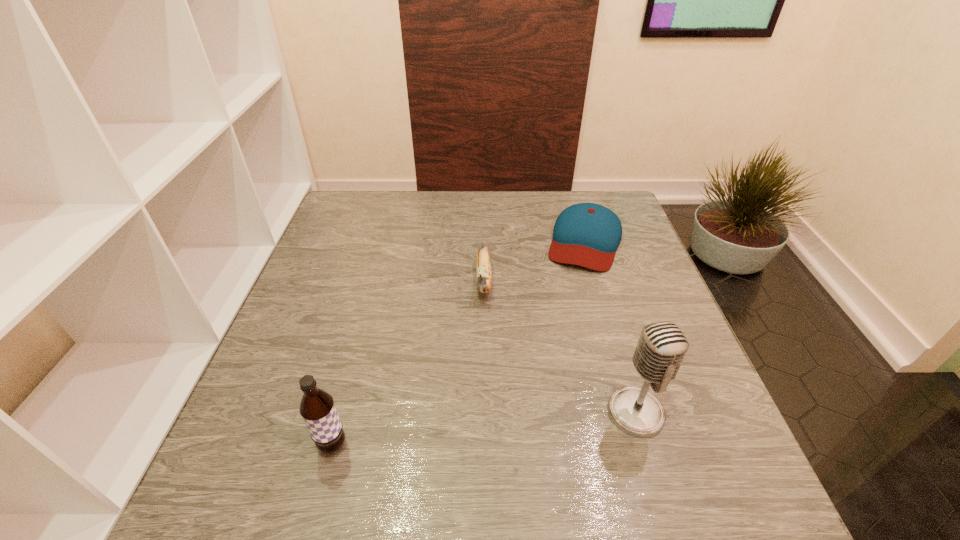
Image resolution: width=960 pixels, height=540 pixels. I want to click on object situated at the near left corner, so click(317, 408).

The height and width of the screenshot is (540, 960). What are the coordinates of `object at the far right corner` in the screenshot? It's located at (585, 234).

Find the location of a particular element. This screenshot has height=540, width=960. object located at the near right corner is located at coordinates (662, 346).

Locate an element on the screen. vacant area at the far edge of the desktop is located at coordinates (550, 206).

In the image, there is a desktop. At what (x,y) coordinates should I click in order to perform the action: click on free space at the near edge. Please return your answer as a coordinate pair (x, y). The image size is (960, 540). Looking at the image, I should click on (602, 437).

Find the location of `vacant space at the left edge`. vacant space at the left edge is located at coordinates (312, 314).

In the image, there is a desktop. Where is `free region at the right edge`? This screenshot has height=540, width=960. free region at the right edge is located at coordinates (638, 373).

The image size is (960, 540). Identify the location of vacant space at the near right corner of the desktop. (736, 446).

You are a GUI agent. You are given a task and a screenshot of the screen. Output one action in this format:
    pyautogui.click(x=<x>, y=<y>)
    Task: Click on the vacant space in between the root beer and the banana
    Image resolution: width=960 pixels, height=540 pixels.
    Given the screenshot: What is the action you would take?
    pyautogui.click(x=409, y=363)

Identify the location of free space between the shortest object and the tallest object. Image resolution: width=960 pixels, height=540 pixels. (611, 327).